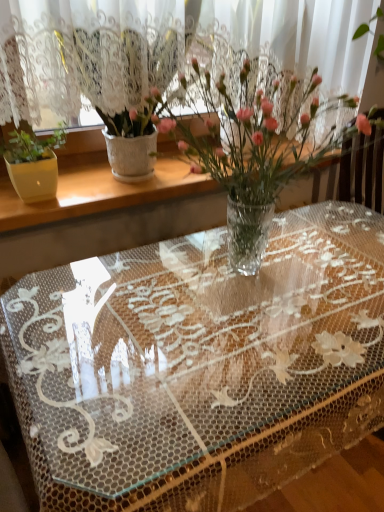
Question: From their relative heights in the image, would you say white textured pot at left, positioned as the first houseplant in left-to-right order, is taller or shorter than clear plastic vase at center, positioned as the first houseplant in right-to-left order?

Choices:
 (A) short
 (B) tall

Answer: (B)

Question: Considering the positions of point (139, 165) and point (291, 83), is point (139, 165) closer or farther from the camera than point (291, 83)?

Choices:
 (A) closer
 (B) farther

Answer: (B)

Question: Based on their relative distances, which object is farther from the white textured pot at left, positioned as the first houseplant in left-to-right order?

Choices:
 (A) clear plastic vase at center, the 2th houseplant viewed from the left
 (B) transparent lace tablecloth at center
 (C) white textured vase at upper left

Answer: (B)

Question: Considering the real-world distances, which object is farthest from the white textured pot at left, positioned as the first houseplant in left-to-right order?

Choices:
 (A) transparent lace tablecloth at center
 (B) white textured vase at upper left
 (C) clear plastic vase at center, the 2th houseplant viewed from the left

Answer: (A)